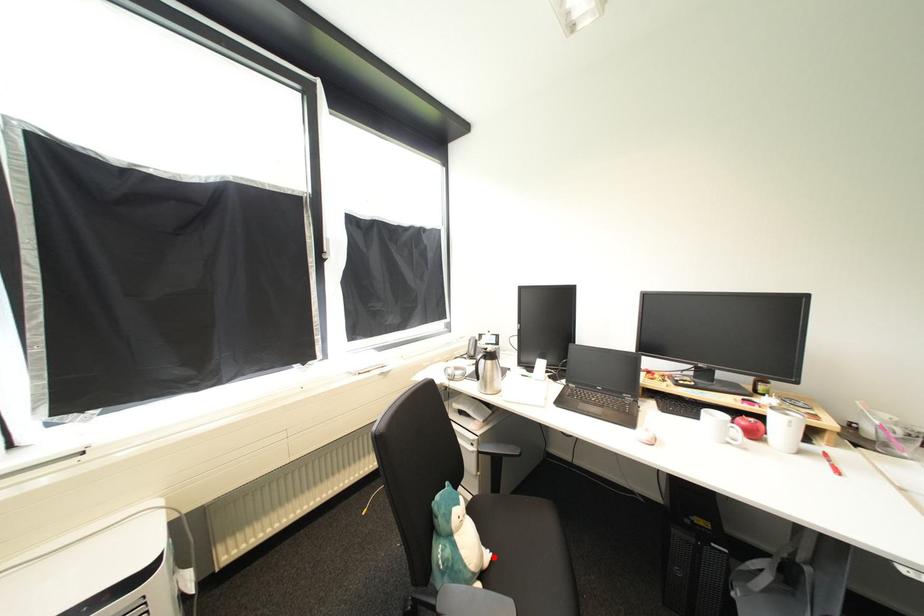
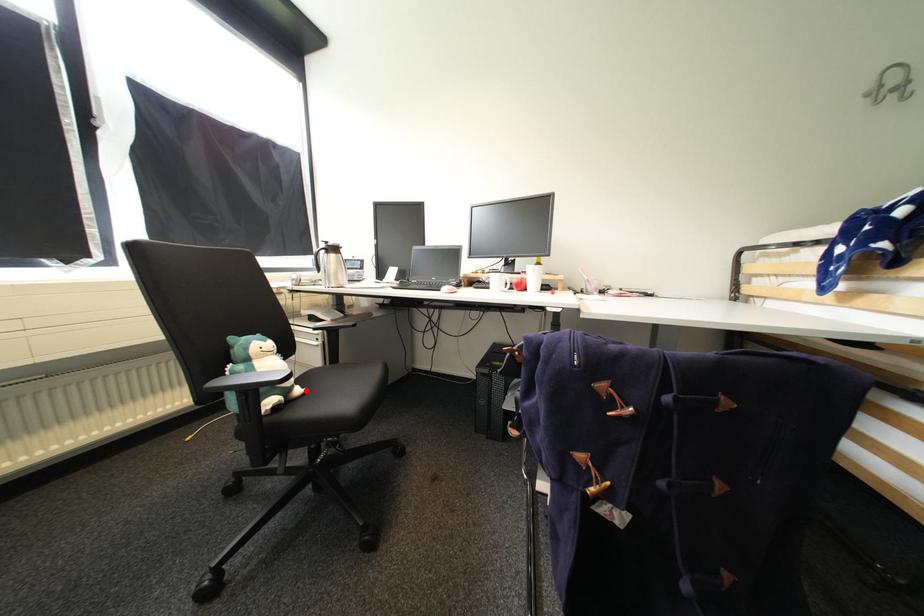
I am providing you with two images of the same scene from different viewpoints. A red point is marked on the first image and another point is marked on the second image. Do the highlighted points in image1 and image2 indicate the same real-world spot?

Yes